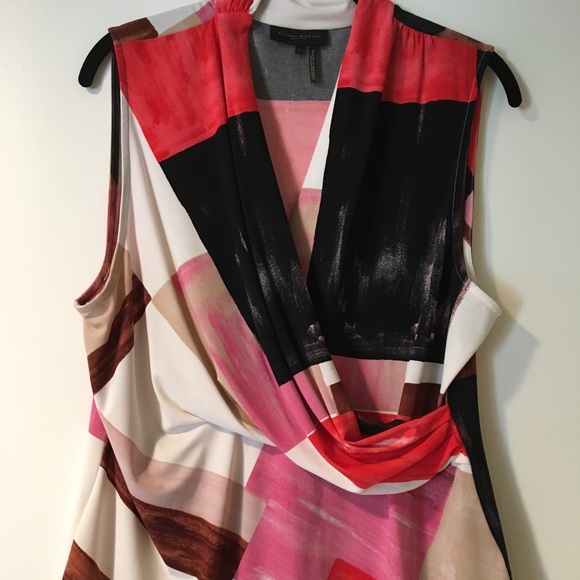
Locate an element on the screen. right hanger is located at coordinates (507, 79).